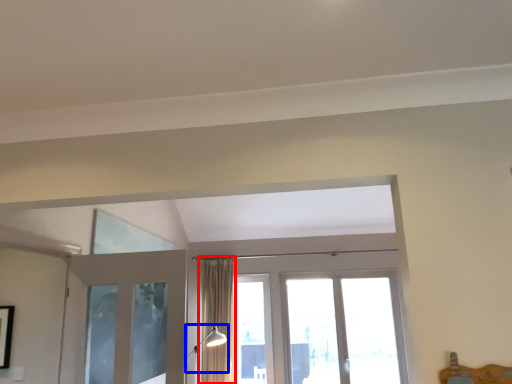
Question: Which object appears farthest to the camera in this image, curtain (highlighted by a red box) or light fixture (highlighted by a blue box)?

Choices:
 (A) curtain
 (B) light fixture

Answer: (A)